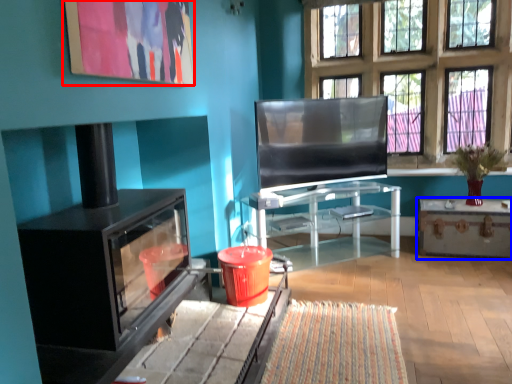
Question: Among these objects, which one is farthest to the camera, picture frame (highlighted by a red box) or table (highlighted by a blue box)?

Choices:
 (A) picture frame
 (B) table

Answer: (B)